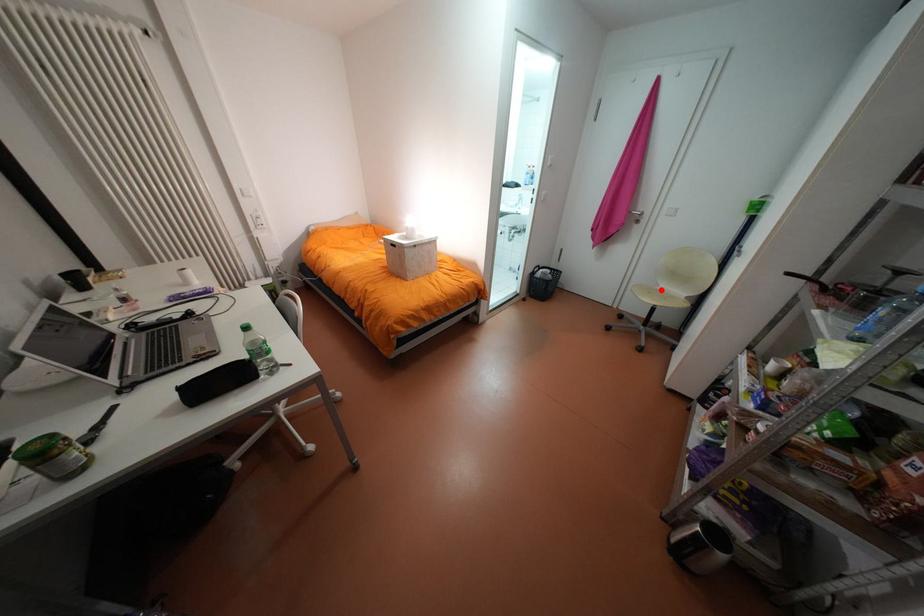
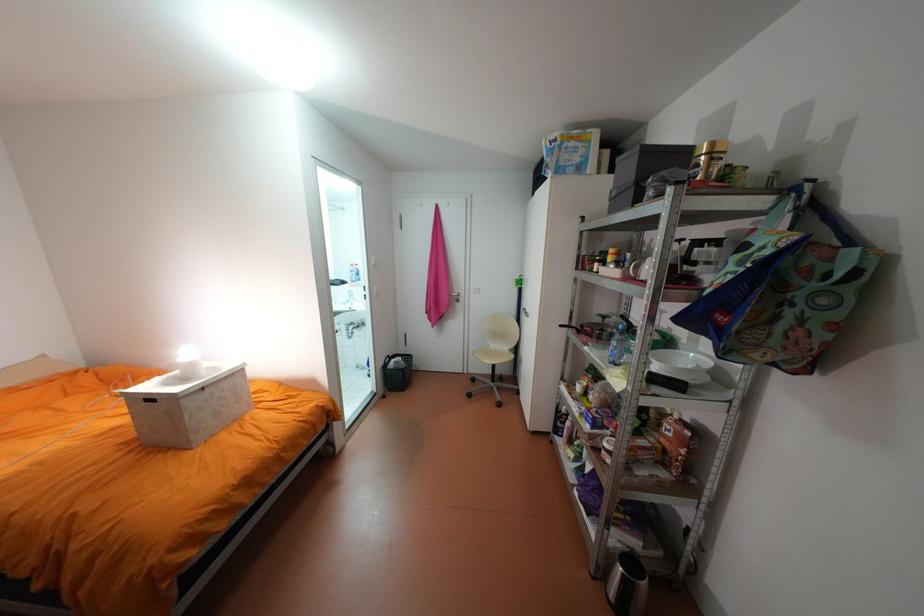
Question: I am providing you with two images of the same scene from different viewpoints. A red point is marked on the first image. Can you still see the location of the red point in image 2?

Choices:
 (A) Yes
 (B) No

Answer: (A)